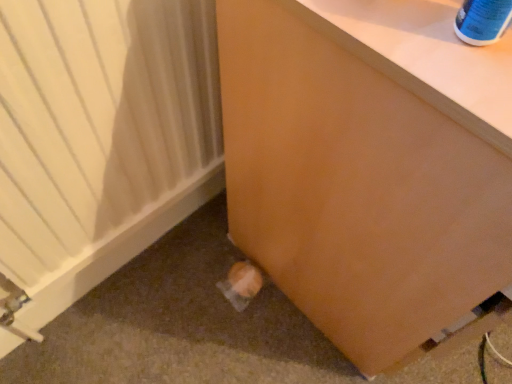
Identify the location of white matte heater at lower left. (101, 137).

This screenshot has height=384, width=512. What do you see at coordinates (101, 137) in the screenshot?
I see `white matte heater at lower left` at bounding box center [101, 137].

Identify the location of matte brown drawer at lower right. The width and height of the screenshot is (512, 384). (370, 169).

Image resolution: width=512 pixels, height=384 pixels. Describe the element at coordinates (370, 169) in the screenshot. I see `matte brown drawer at lower right` at that location.

You are a GUI agent. You are given a task and a screenshot of the screen. Output one action in this format:
    pyautogui.click(x=<x>, y=<y>)
    Task: Click on the white matte heater at lower left
    This screenshot has width=512, height=384.
    Given the screenshot: What is the action you would take?
    pyautogui.click(x=101, y=137)

Which object is positioned more to the right, matte brown drawer at lower right or white matte heater at lower left?

matte brown drawer at lower right.

Is matte brown drawer at lower right in front of or behind white matte heater at lower left in the image?

Clearly, matte brown drawer at lower right is in front of white matte heater at lower left.

Is point (251, 115) farther from viewer compared to point (5, 154)?

That is True.

From the image's perspective, is matte brown drawer at lower right located above white matte heater at lower left?

Yes, from the image's perspective, matte brown drawer at lower right is above white matte heater at lower left.

From a real-world perspective, does matte brown drawer at lower right stand above white matte heater at lower left?

Yes, from a real-world perspective, matte brown drawer at lower right is on top of white matte heater at lower left.

In the scene shown: Considering the sizes of objects matte brown drawer at lower right and white matte heater at lower left in the image provided, who is wider, matte brown drawer at lower right or white matte heater at lower left?

Wider between the two is matte brown drawer at lower right.

Can you confirm if matte brown drawer at lower right is shorter than white matte heater at lower left?

In fact, matte brown drawer at lower right may be taller than white matte heater at lower left.

Which of these two, matte brown drawer at lower right or white matte heater at lower left, is bigger?

matte brown drawer at lower right is bigger.

Is matte brown drawer at lower right not within white matte heater at lower left?

That's correct, matte brown drawer at lower right is outside of white matte heater at lower left.

Is matte brown drawer at lower right not close to white matte heater at lower left?

No, there isn't a large distance between matte brown drawer at lower right and white matte heater at lower left.

Is matte brown drawer at lower right turned away from white matte heater at lower left?

matte brown drawer at lower right is not turned away from white matte heater at lower left.

How many degrees apart are the facing directions of matte brown drawer at lower right and white matte heater at lower left?

The facing directions of matte brown drawer at lower right and white matte heater at lower left are 1.44 degrees apart.

How far apart are matte brown drawer at lower right and white matte heater at lower left?

The distance of matte brown drawer at lower right from white matte heater at lower left is 10.38 inches.

The height and width of the screenshot is (384, 512). What are the coordinates of `heater located on the left of matte brown drawer at lower right` in the screenshot? It's located at (101, 137).

From the picture: Does white matte heater at lower left appear on the left side of matte brown drawer at lower right?

Correct, you'll find white matte heater at lower left to the left of matte brown drawer at lower right.

Considering the positions of objects white matte heater at lower left and matte brown drawer at lower right in the image provided, who is behind, white matte heater at lower left or matte brown drawer at lower right?

white matte heater at lower left.

Does point (98, 231) appear closer or farther from the camera than point (224, 103)?

Clearly, point (98, 231) is more distant from the camera than point (224, 103).

From the image's perspective, is white matte heater at lower left above matte brown drawer at lower right?

No, from the image's perspective, white matte heater at lower left is not on top of matte brown drawer at lower right.

From a real-world perspective, is white matte heater at lower left positioned above or below matte brown drawer at lower right?

white matte heater at lower left is situated lower than matte brown drawer at lower right in the real world.

In the scene shown: Between white matte heater at lower left and matte brown drawer at lower right, which one has larger width?

matte brown drawer at lower right.

Is white matte heater at lower left shorter than matte brown drawer at lower right?

Yes.

Which of these two, white matte heater at lower left or matte brown drawer at lower right, is bigger?

Bigger between the two is matte brown drawer at lower right.

Is white matte heater at lower left inside the boundaries of matte brown drawer at lower right, or outside?

white matte heater at lower left is outside matte brown drawer at lower right.

In the scene shown: Are white matte heater at lower left and matte brown drawer at lower right making contact?

No, white matte heater at lower left is not touching matte brown drawer at lower right.

Is white matte heater at lower left aimed at matte brown drawer at lower right?

Yes, white matte heater at lower left is facing matte brown drawer at lower right.

Consider the image. How far apart are white matte heater at lower left and matte brown drawer at lower right?

white matte heater at lower left is 26.37 centimeters away from matte brown drawer at lower right.

Where is `furniture in front of the white matte heater at lower left`? The width and height of the screenshot is (512, 384). furniture in front of the white matte heater at lower left is located at coordinates (370, 169).

The height and width of the screenshot is (384, 512). I want to click on heater below the matte brown drawer at lower right (from the image's perspective), so click(x=101, y=137).

Identify the location of furniture above the white matte heater at lower left (from the image's perspective). The image size is (512, 384). (370, 169).